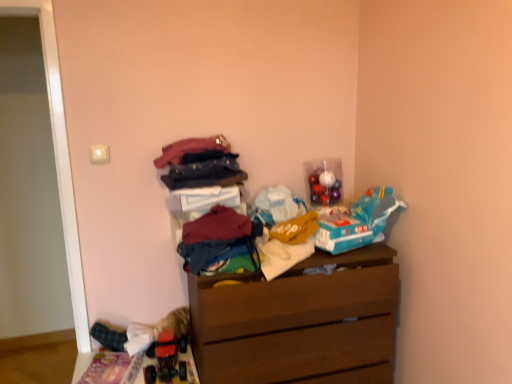
Identify the location of matte pink fabric at upper center, marked as the third clothing in a bottom-to-top arrangement. (190, 149).

Describe the element at coordinates (217, 238) in the screenshot. I see `multicolored fabric pile at center, acting as the 1th clothing starting from the bottom` at that location.

Image resolution: width=512 pixels, height=384 pixels. Identify the location of shiny metallic ornaments at upper right, marked as the 2th toy in a front-to-back arrangement. (324, 181).

What do you see at coordinates (324, 181) in the screenshot? The height and width of the screenshot is (384, 512). I see `shiny metallic ornaments at upper right, placed as the 1th toy when sorted from back to front` at bounding box center [324, 181].

What do you see at coordinates (298, 322) in the screenshot?
I see `brown wooden chest of drawers at center` at bounding box center [298, 322].

Looking at this image, what is the approximate height of rubberized plastic toy car at lower left, the 1th toy in the front-to-back sequence?

It is 5.07 inches.

This screenshot has width=512, height=384. What do you see at coordinates (166, 358) in the screenshot? I see `rubberized plastic toy car at lower left, acting as the first toy starting from the bottom` at bounding box center [166, 358].

What is the approximate height of dark red fabric at center, acting as the 2th clothing starting from the top?

It is 5.32 inches.

Where is `matte pink fabric at upper center, marked as the first clothing in a top-to-bottom arrangement`? matte pink fabric at upper center, marked as the first clothing in a top-to-bottom arrangement is located at coordinates (190, 149).

From the image's perspective, which one is positioned lower, shiny metallic ornaments at upper right, the first toy positioned from the top, or dark red fabric at center, acting as the 2th clothing starting from the top?

dark red fabric at center, acting as the 2th clothing starting from the top, is shown below in the image.

What's the angular difference between shiny metallic ornaments at upper right, the second toy positioned from the left, and dark red fabric at center, which ranks as the 2th clothing in bottom-to-top order,'s facing directions?

They differ by 14.5 degrees in their facing directions.

Based on the photo, from their relative heights in the image, would you say shiny metallic ornaments at upper right, the 2th toy when ordered from bottom to top, is taller or shorter than dark red fabric at center, acting as the 2th clothing starting from the top?

Clearly, shiny metallic ornaments at upper right, the 2th toy when ordered from bottom to top, is taller compared to dark red fabric at center, acting as the 2th clothing starting from the top.

From a real-world perspective, is shiny metallic ornaments at upper right, positioned as the 1th toy in right-to-left order, above or below dark red fabric at center, acting as the 2th clothing starting from the top?

From a real-world perspective, shiny metallic ornaments at upper right, positioned as the 1th toy in right-to-left order, is physically above dark red fabric at center, acting as the 2th clothing starting from the top.

From a real-world perspective, is shiny metallic ornaments at upper right, the second toy positioned from the left, physically above matte pink fabric at upper center, marked as the third clothing in a bottom-to-top arrangement?

Actually, shiny metallic ornaments at upper right, the second toy positioned from the left, is physically below matte pink fabric at upper center, marked as the third clothing in a bottom-to-top arrangement, in the real world.

Who is shorter, shiny metallic ornaments at upper right, positioned as the 1th toy in right-to-left order, or matte pink fabric at upper center, marked as the third clothing in a bottom-to-top arrangement?

Standing shorter between the two is matte pink fabric at upper center, marked as the third clothing in a bottom-to-top arrangement.

Which is more to the right, shiny metallic ornaments at upper right, marked as the 2th toy in a front-to-back arrangement, or matte pink fabric at upper center, marked as the third clothing in a bottom-to-top arrangement?

Positioned to the right is shiny metallic ornaments at upper right, marked as the 2th toy in a front-to-back arrangement.

Locate an element on the screen. toy on the left of the brown wooden chest of drawers at center is located at coordinates (166, 358).

Is brown wooden chest of drawers at center bigger than rubberized plastic toy car at lower left, the second toy positioned from the right?

Correct, brown wooden chest of drawers at center is larger in size than rubberized plastic toy car at lower left, the second toy positioned from the right.

From the image's perspective, is brown wooden chest of drawers at center located above or below rubberized plastic toy car at lower left, acting as the first toy starting from the bottom?

Based on their image positions, brown wooden chest of drawers at center is located above rubberized plastic toy car at lower left, acting as the first toy starting from the bottom.

Considering the relative sizes of brown wooden chest of drawers at center and rubberized plastic toy car at lower left, the 2th toy viewed from the back, in the image provided, is brown wooden chest of drawers at center thinner than rubberized plastic toy car at lower left, the 2th toy viewed from the back,?

No, brown wooden chest of drawers at center is not thinner than rubberized plastic toy car at lower left, the 2th toy viewed from the back.

Does point (186, 143) lie behind point (320, 310)?

Yes, point (186, 143) is behind point (320, 310).

The image size is (512, 384). There is a brown wooden chest of drawers at center. Identify the location of the 3rd clothing above it (from the image's perspective). (190, 149).

Is matte pink fabric at upper center, marked as the first clothing in a top-to-bottom arrangement, positioned beyond the bounds of brown wooden chest of drawers at center?

Indeed, matte pink fabric at upper center, marked as the first clothing in a top-to-bottom arrangement, is completely outside brown wooden chest of drawers at center.

Does matte pink fabric at upper center, marked as the first clothing in a top-to-bottom arrangement, come behind brown wooden chest of drawers at center?

Yes, the depth of matte pink fabric at upper center, marked as the first clothing in a top-to-bottom arrangement, is greater than that of brown wooden chest of drawers at center.

Considering the positions of objects brown wooden chest of drawers at center and dark red fabric at center, which ranks as the 2th clothing in bottom-to-top order, in the image provided, who is more to the left, brown wooden chest of drawers at center or dark red fabric at center, which ranks as the 2th clothing in bottom-to-top order,?

dark red fabric at center, which ranks as the 2th clothing in bottom-to-top order.

Which object is wider, brown wooden chest of drawers at center or dark red fabric at center, which ranks as the 2th clothing in bottom-to-top order?

brown wooden chest of drawers at center.

Which clothing is the 2nd one when counting from the left side of the brown wooden chest of drawers at center? Please provide its 2D coordinates.

[(217, 226)]

From the image's perspective, which object appears higher, brown wooden chest of drawers at center or dark red fabric at center, which ranks as the 2th clothing in bottom-to-top order?

dark red fabric at center, which ranks as the 2th clothing in bottom-to-top order.

Between brown wooden chest of drawers at center and matte pink fabric at upper center, marked as the first clothing in a top-to-bottom arrangement, which one appears on the left side from the viewer's perspective?

Positioned to the left is matte pink fabric at upper center, marked as the first clothing in a top-to-bottom arrangement.

Does brown wooden chest of drawers at center turn towards matte pink fabric at upper center, marked as the first clothing in a top-to-bottom arrangement?

No, brown wooden chest of drawers at center does not turn towards matte pink fabric at upper center, marked as the first clothing in a top-to-bottom arrangement.

Based on the photo, does brown wooden chest of drawers at center have a lesser height compared to matte pink fabric at upper center, marked as the third clothing in a bottom-to-top arrangement?

No, brown wooden chest of drawers at center is not shorter than matte pink fabric at upper center, marked as the third clothing in a bottom-to-top arrangement.

From the image's perspective, count 3rd clothings upward from the brown wooden chest of drawers at center and point to it. Please provide its 2D coordinates.

[(190, 149)]

From the picture: Considering the sizes of objects multicolored fabric pile at center, acting as the 1th clothing starting from the bottom, and shiny metallic ornaments at upper right, the second toy positioned from the left, in the image provided, who is bigger, multicolored fabric pile at center, acting as the 1th clothing starting from the bottom, or shiny metallic ornaments at upper right, the second toy positioned from the left,?

multicolored fabric pile at center, acting as the 1th clothing starting from the bottom, is bigger.

Could you tell me if multicolored fabric pile at center, which is the third clothing from top to bottom, is turned towards shiny metallic ornaments at upper right, the 2th toy when ordered from bottom to top?

No, multicolored fabric pile at center, which is the third clothing from top to bottom, is not facing towards shiny metallic ornaments at upper right, the 2th toy when ordered from bottom to top.

Is multicolored fabric pile at center, which is the third clothing from top to bottom, taller than shiny metallic ornaments at upper right, marked as the 2th toy in a front-to-back arrangement?

No.

Which point is more distant from viewer, (191, 222) or (320, 193)?

Point (320, 193)

You are a GUI agent. You are given a task and a screenshot of the screen. Output one action in this format:
    pyautogui.click(x=<x>, y=<y>)
    Task: Click on the clothing that is the 2nd one when counting forward from the shiny metallic ornaments at upper right, placed as the 1th toy when sorted from back to front
    This screenshot has height=384, width=512.
    Given the screenshot: What is the action you would take?
    pyautogui.click(x=217, y=226)

From the shiny metallic ornaments at upper right, placed as the 1th toy when sorted from back to front, count the 3rd clothing to the left and point to it. Please provide its 2D coordinates.

[(190, 149)]

When comparing their distances from rubberized plastic toy car at lower left, the 1th toy in the front-to-back sequence, does shiny metallic ornaments at upper right, marked as the 2th toy in a front-to-back arrangement, or brown wooden chest of drawers at center seem closer?

brown wooden chest of drawers at center.

When comparing their distances from brown wooden chest of drawers at center, does shiny metallic ornaments at upper right, marked as the 2th toy in a front-to-back arrangement, or matte pink fabric at upper center, marked as the third clothing in a bottom-to-top arrangement, seem closer?

Based on the image, shiny metallic ornaments at upper right, marked as the 2th toy in a front-to-back arrangement, appears to be nearer to brown wooden chest of drawers at center.

Which object lies further to the anchor point dark red fabric at center, which ranks as the 2th clothing in bottom-to-top order, rubberized plastic toy car at lower left, acting as the first toy starting from the bottom, or brown wooden chest of drawers at center?

Among the two, rubberized plastic toy car at lower left, acting as the first toy starting from the bottom, is located further to dark red fabric at center, which ranks as the 2th clothing in bottom-to-top order.

Based on their spatial positions, is dark red fabric at center, which ranks as the 2th clothing in bottom-to-top order, or matte pink fabric at upper center, marked as the first clothing in a top-to-bottom arrangement, closer to brown wooden chest of drawers at center?

Among the two, dark red fabric at center, which ranks as the 2th clothing in bottom-to-top order, is located nearer to brown wooden chest of drawers at center.

Estimate the real-world distances between objects in this image. Which object is closer to brown wooden chest of drawers at center, rubberized plastic toy car at lower left, the 2th toy when ordered from top to bottom, or dark red fabric at center, acting as the 2th clothing starting from the top?

dark red fabric at center, acting as the 2th clothing starting from the top, is closer to brown wooden chest of drawers at center.

When comparing their distances from dark red fabric at center, acting as the 2th clothing starting from the top, does brown wooden chest of drawers at center or shiny metallic ornaments at upper right, positioned as the 1th toy in right-to-left order, seem further?

shiny metallic ornaments at upper right, positioned as the 1th toy in right-to-left order, lies further to dark red fabric at center, acting as the 2th clothing starting from the top, than the other object.

When comparing their distances from shiny metallic ornaments at upper right, the first toy positioned from the top, does matte pink fabric at upper center, marked as the third clothing in a bottom-to-top arrangement, or multicolored fabric pile at center, acting as the 1th clothing starting from the bottom, seem closer?

matte pink fabric at upper center, marked as the third clothing in a bottom-to-top arrangement, lies closer to shiny metallic ornaments at upper right, the first toy positioned from the top, than the other object.

Based on their spatial positions, is rubberized plastic toy car at lower left, the first toy positioned from the left, or multicolored fabric pile at center, acting as the 1th clothing starting from the bottom, closer to shiny metallic ornaments at upper right, marked as the 2th toy in a front-to-back arrangement?

The object closer to shiny metallic ornaments at upper right, marked as the 2th toy in a front-to-back arrangement, is multicolored fabric pile at center, acting as the 1th clothing starting from the bottom.

You are a GUI agent. You are given a task and a screenshot of the screen. Output one action in this format:
    pyautogui.click(x=<x>, y=<y>)
    Task: Click on the toy between matte pink fabric at upper center, marked as the third clothing in a bottom-to-top arrangement, and brown wooden chest of drawers at center, in the vertical direction
    This screenshot has width=512, height=384.
    Given the screenshot: What is the action you would take?
    pyautogui.click(x=324, y=181)

In order to click on the chest of drawers that lies between multicolored fabric pile at center, acting as the 1th clothing starting from the bottom, and rubberized plastic toy car at lower left, the 2th toy viewed from the back, from top to bottom in this screenshot , I will do `click(298, 322)`.

At what (x,y) coordinates should I click in order to perform the action: click on clothing between dark red fabric at center, which ranks as the 2th clothing in bottom-to-top order, and rubberized plastic toy car at lower left, the 1th toy in the front-to-back sequence, in the up-down direction. Please return your answer as a coordinate pair (x, y). The height and width of the screenshot is (384, 512). Looking at the image, I should click on pos(217,238).

Where is `chest of drawers between dark red fabric at center, which ranks as the 2th clothing in bottom-to-top order, and rubberized plastic toy car at lower left, the second toy positioned from the right, in the up-down direction`? This screenshot has height=384, width=512. chest of drawers between dark red fabric at center, which ranks as the 2th clothing in bottom-to-top order, and rubberized plastic toy car at lower left, the second toy positioned from the right, in the up-down direction is located at coordinates (298, 322).